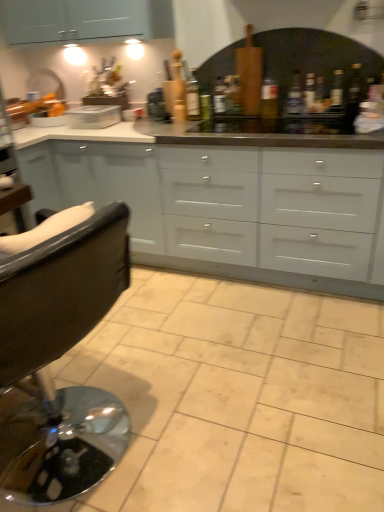
You are a GUI agent. You are given a task and a screenshot of the screen. Output one action in this format:
    pyautogui.click(x=<x>, y=<y>)
    Task: Click on the empty space that is ontop of beige ceramic tile at center
    This screenshot has height=512, width=384.
    Given the screenshot: What is the action you would take?
    pyautogui.click(x=193, y=372)